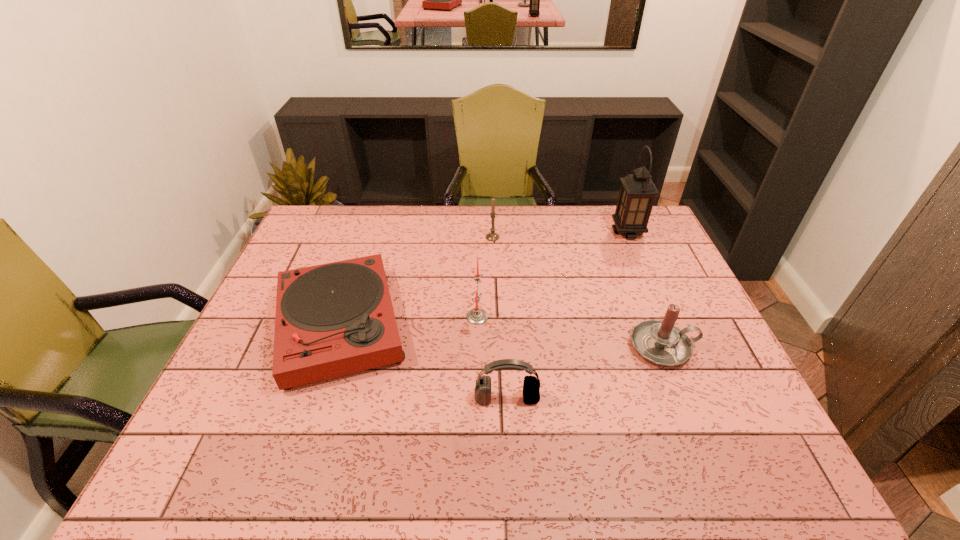
You are a GUI agent. You are given a task and a screenshot of the screen. Output one action in this format:
    pyautogui.click(x=<x>, y=<y>)
    Task: Click on the vacant position in the image that satisfies the following two spatial constraints: 1. on the back side of the leftmost object; 2. on the left side of the tallest object
    This screenshot has height=540, width=960.
    Given the screenshot: What is the action you would take?
    pyautogui.click(x=371, y=232)